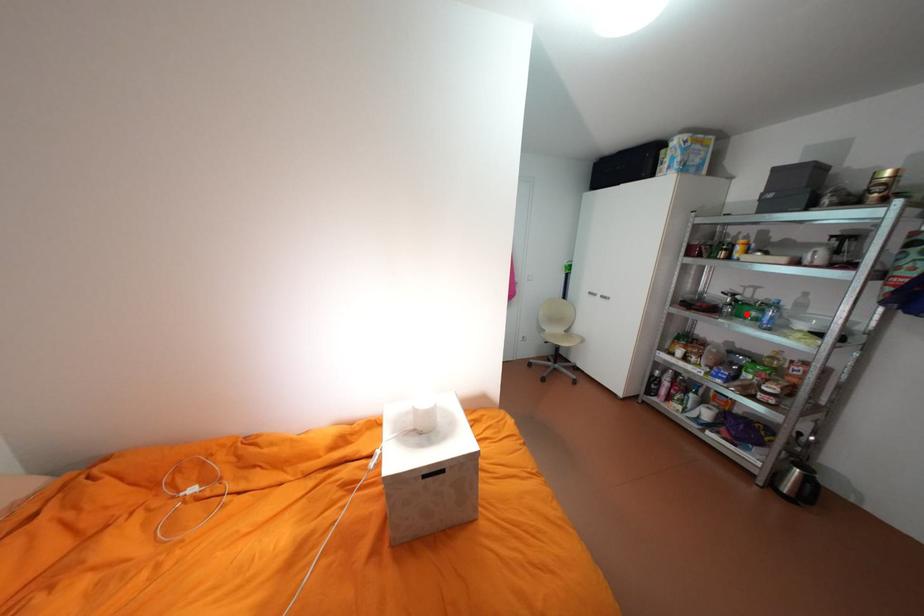
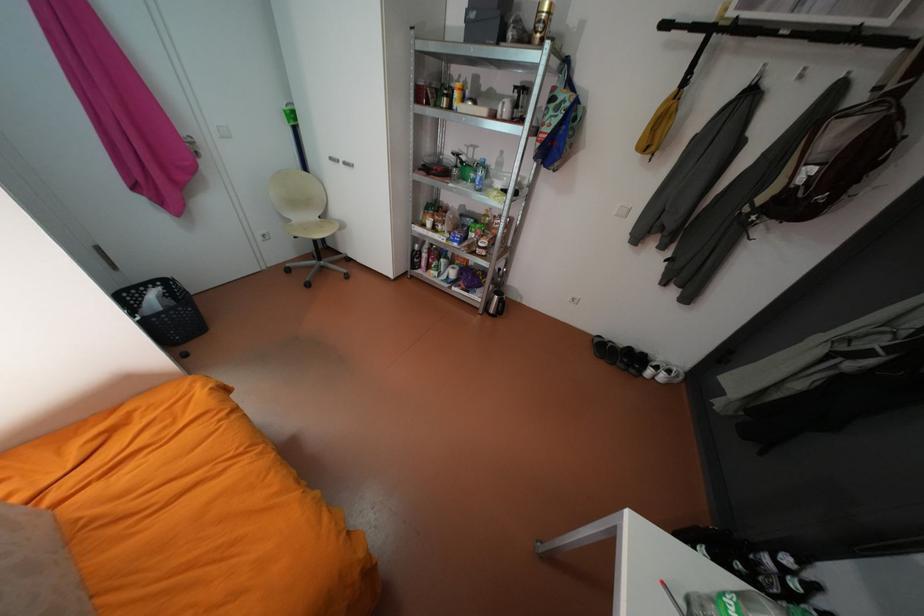
Locate, in the second image, the point that corresponds to the highlighted location in the first image.

(471, 177)